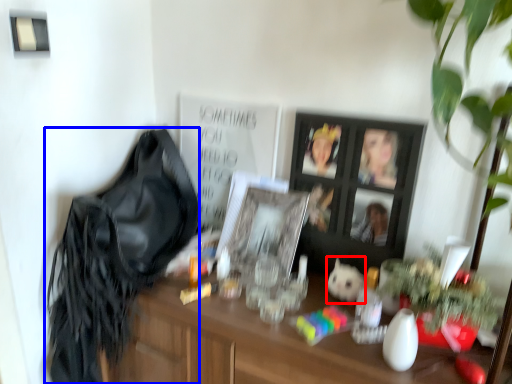
Question: Which of the following is the closest to the observer, animal (highlighted by a red box) or shoulder bag (highlighted by a blue box)?

Choices:
 (A) animal
 (B) shoulder bag

Answer: (B)